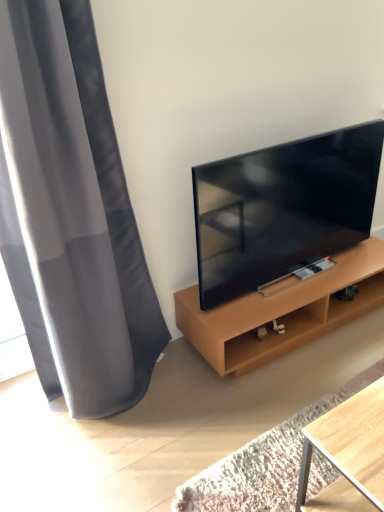
This screenshot has height=512, width=384. What are the coordinates of `vacant area that is in front of gray fabric curtain at left` in the screenshot? It's located at (125, 455).